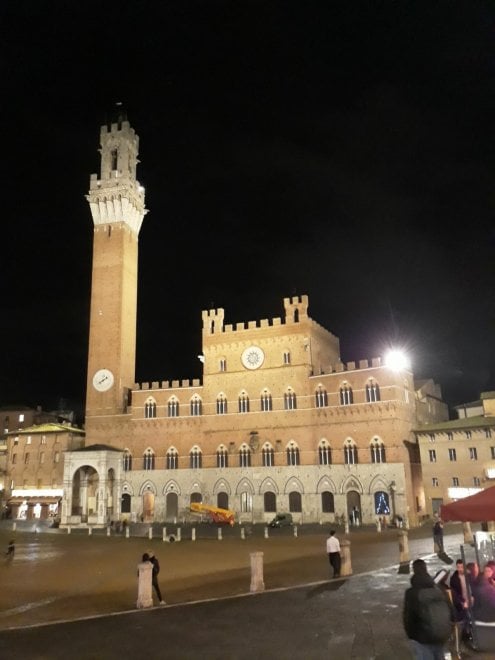
Where is `light in window`? light in window is located at coordinates click(20, 416).